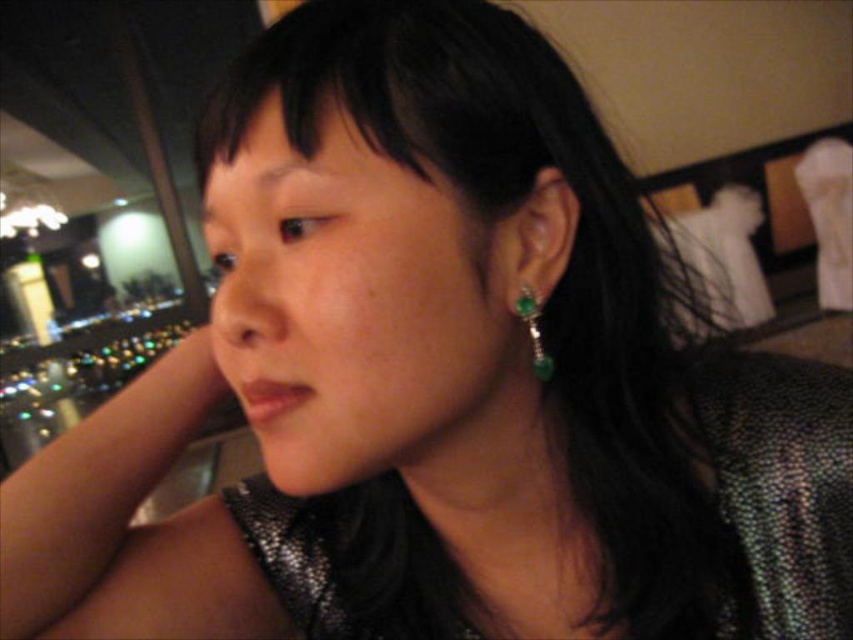
Between black shiny hair at center and emerald-green gemstone at ear, which one appears on the left side from the viewer's perspective?

Positioned to the left is emerald-green gemstone at ear.

Is point (438, 58) closer to camera compared to point (537, 337)?

Yes, point (438, 58) is closer to viewer.

Image resolution: width=853 pixels, height=640 pixels. Describe the element at coordinates (554, 282) in the screenshot. I see `black shiny hair at center` at that location.

Find the location of a particular element. black shiny hair at center is located at coordinates (554, 282).